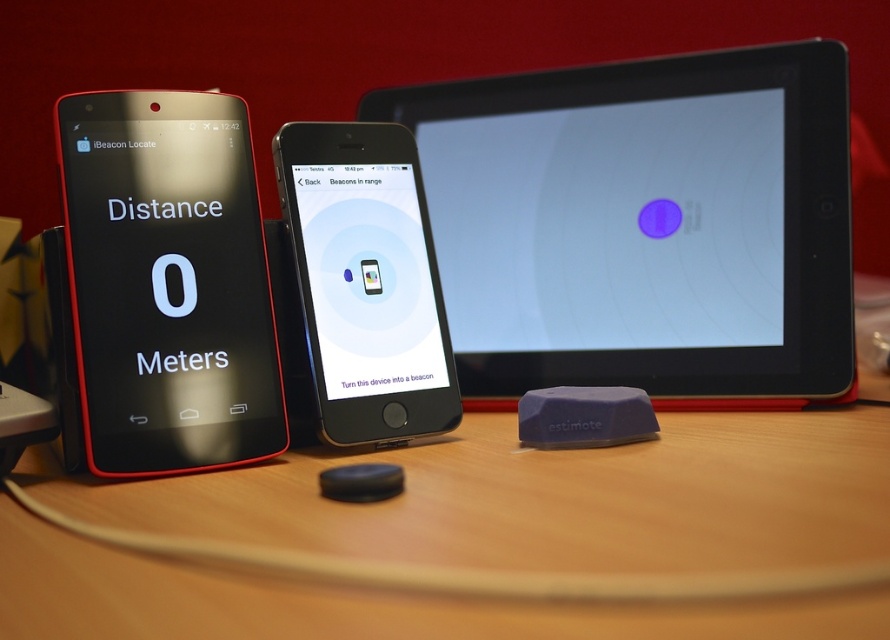
Is matte black tablet at center taller than black glossy phone at left?

Yes, matte black tablet at center is taller than black glossy phone at left.

Which is behind, point (670, 196) or point (276, 417)?

Positioned behind is point (670, 196).

Is point (541, 188) positioned behind point (146, 355)?

Yes, point (541, 188) is farther from viewer.

Find the location of a particular element. Image resolution: width=890 pixels, height=640 pixels. matte black tablet at center is located at coordinates (641, 227).

Can you confirm if wooden table at center is thinner than black glossy phone at left?

In fact, wooden table at center might be wider than black glossy phone at left.

What are the coordinates of `wooden table at center` in the screenshot? It's located at (546, 499).

Who is lower down, wooden table at center or black glossy ipod touch at center?

wooden table at center is below.

Is point (872, 477) closer to viewer compared to point (314, 157)?

That is True.

Locate an element on the screen. wooden table at center is located at coordinates (546, 499).

Locate an element on the screen. wooden table at center is located at coordinates (546, 499).